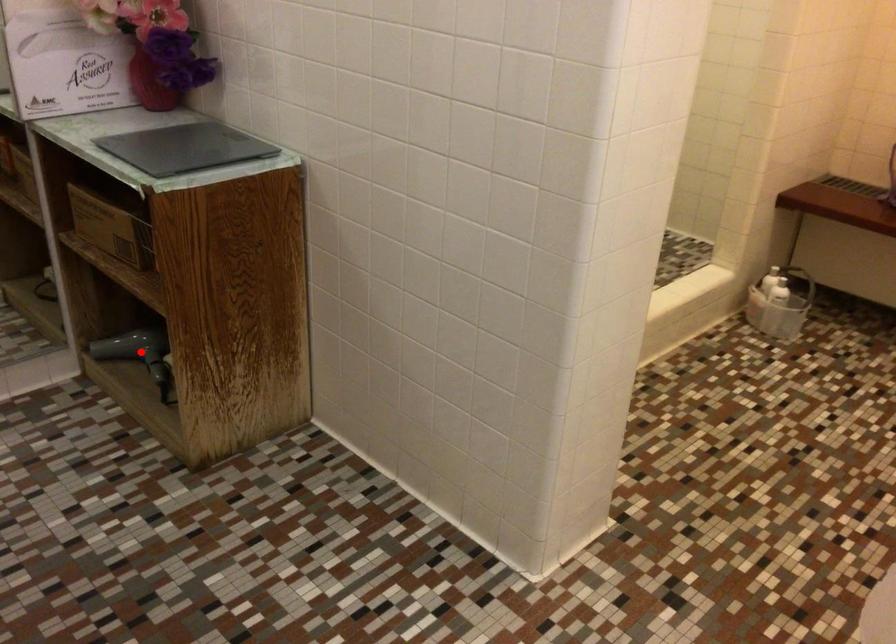
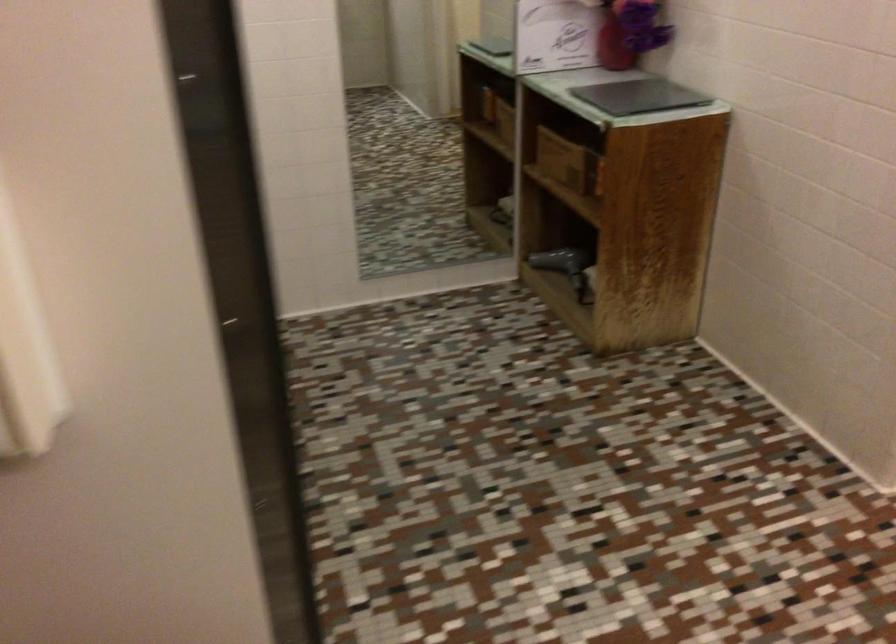
Question: I am providing you with two images of the same scene from different viewpoints. Given a red point in image1, look at the same physical point in image2. Is it:

Choices:
 (A) Closer to the viewpoint
 (B) Farther from the viewpoint

Answer: (B)